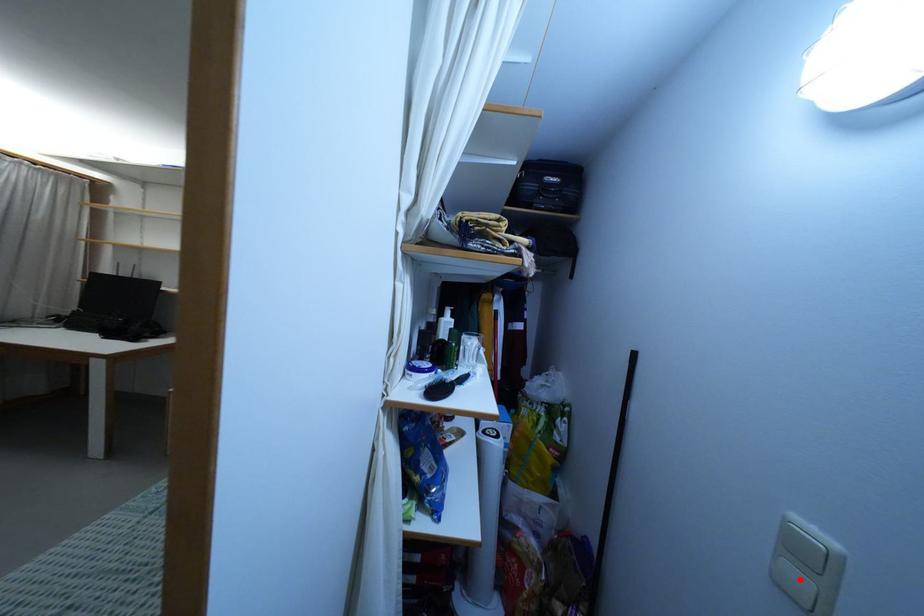
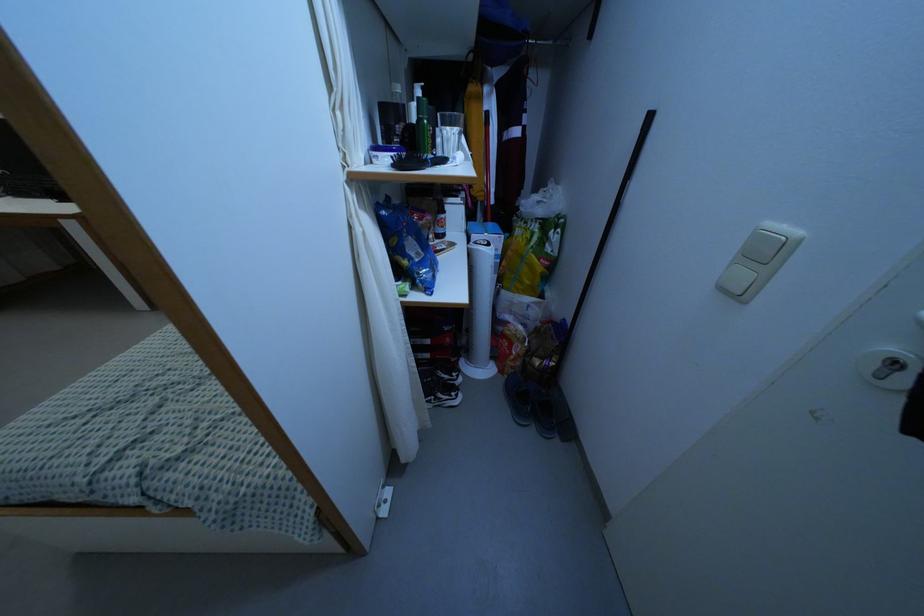
Locate, in the second image, the point that corresponds to the highlighted location in the first image.

(743, 276)